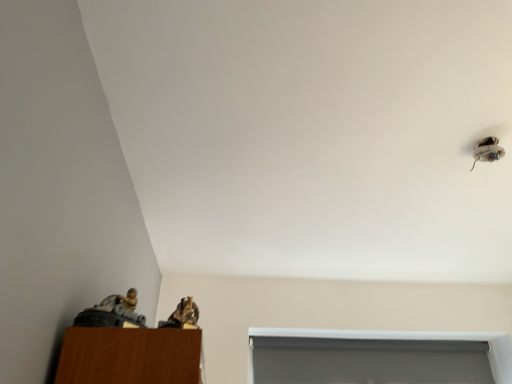
Find the location of a particular element. This screenshot has width=512, height=384. brown textured figurine at lower left is located at coordinates tap(185, 313).

Measure the distance between point (490, 155) and camera.

Point (490, 155) and camera are 1.23 meters apart from each other.

Locate an element on the screen. The height and width of the screenshot is (384, 512). white glossy shoe at upper right is located at coordinates (487, 150).

Find the location of a particular element. This screenshot has height=384, width=512. brown textured figurine at lower left is located at coordinates (185, 313).

Considering the relative positions of white matte window at lower center and brown textured figurine at lower left in the image provided, is white matte window at lower center to the right of brown textured figurine at lower left from the viewer's perspective?

Yes, white matte window at lower center is to the right of brown textured figurine at lower left.

What are the coordinates of `animal lying above the white matte window at lower center (from the image's perspective)` in the screenshot? It's located at (185, 313).

From a real-world perspective, is white matte window at lower center physically above brown textured figurine at lower left?

Yes.

Considering the relative sizes of brown textured figurine at lower left and white matte window at lower center in the image provided, is brown textured figurine at lower left taller than white matte window at lower center?

Incorrect, the height of brown textured figurine at lower left is not larger of that of white matte window at lower center.

From the picture: Is brown textured figurine at lower left turned away from white matte window at lower center?

That's not correct — brown textured figurine at lower left is not looking away from white matte window at lower center.

Considering the sizes of objects brown textured figurine at lower left and white matte window at lower center in the image provided, who is bigger, brown textured figurine at lower left or white matte window at lower center?

With larger size is white matte window at lower center.

Is white glossy shoe at upper right turned away from brown textured figurine at lower left?

white glossy shoe at upper right is not turned away from brown textured figurine at lower left.

From a real-world perspective, relative to brown textured figurine at lower left, is white glossy shoe at upper right vertically above or below?

From a real-world perspective, white glossy shoe at upper right is physically above brown textured figurine at lower left.

Is white glossy shoe at upper right at the right side of brown textured figurine at lower left?

Indeed, white glossy shoe at upper right is positioned on the right side of brown textured figurine at lower left.

Considering the relative sizes of white matte window at lower center and white glossy shoe at upper right in the image provided, is white matte window at lower center thinner than white glossy shoe at upper right?

Correct, the width of white matte window at lower center is less than that of white glossy shoe at upper right.

Is white matte window at lower center not within white glossy shoe at upper right?

Indeed, white matte window at lower center is completely outside white glossy shoe at upper right.

Which is in front, point (472, 337) or point (494, 146)?

The point (494, 146) is more forward.

Image resolution: width=512 pixels, height=384 pixels. I want to click on lamp behind the brown textured figurine at lower left, so click(487, 150).

Is white glossy shoe at upper right at the back of brown textured figurine at lower left?

No.

From the image's perspective, between brown textured figurine at lower left and white glossy shoe at upper right, who is located below?

brown textured figurine at lower left.

Would you say white glossy shoe at upper right is a long distance from white matte window at lower center?

That's right, there is a large distance between white glossy shoe at upper right and white matte window at lower center.

Between white glossy shoe at upper right and white matte window at lower center, which one has larger size?

With larger size is white matte window at lower center.

What's the angular difference between white glossy shoe at upper right and white matte window at lower center's facing directions?

4.13 degrees separate the facing orientations of white glossy shoe at upper right and white matte window at lower center.

Between point (500, 156) and point (416, 334), which one is positioned behind?

The point (416, 334) is farther from the camera.

Image resolution: width=512 pixels, height=384 pixels. In order to click on window on the right of brown textured figurine at lower left in this screenshot , I will do point(412,339).

Locate an element on the screen. window lying behind the brown textured figurine at lower left is located at coordinates (412, 339).

Which object lies further to the anchor point white glossy shoe at upper right, white matte window at lower center or brown textured figurine at lower left?

Based on the image, white matte window at lower center appears to be further to white glossy shoe at upper right.

From the image, which object appears to be nearer to brown textured figurine at lower left, white matte window at lower center or white glossy shoe at upper right?

white glossy shoe at upper right is positioned closer to the anchor brown textured figurine at lower left.

When comparing their distances from white glossy shoe at upper right, does brown textured figurine at lower left or white matte window at lower center seem closer?

brown textured figurine at lower left.

From the image, which object appears to be nearer to white matte window at lower center, brown textured figurine at lower left or white glossy shoe at upper right?

white glossy shoe at upper right is closer to white matte window at lower center.

When comparing their distances from brown textured figurine at lower left, does white glossy shoe at upper right or white matte window at lower center seem further?

The object further to brown textured figurine at lower left is white matte window at lower center.

From the image, which object appears to be nearer to white matte window at lower center, white glossy shoe at upper right or brown textured figurine at lower left?

white glossy shoe at upper right is closer to white matte window at lower center.

Where is `lamp located between brown textured figurine at lower left and white matte window at lower center in the depth direction`? This screenshot has width=512, height=384. lamp located between brown textured figurine at lower left and white matte window at lower center in the depth direction is located at coordinates (487, 150).